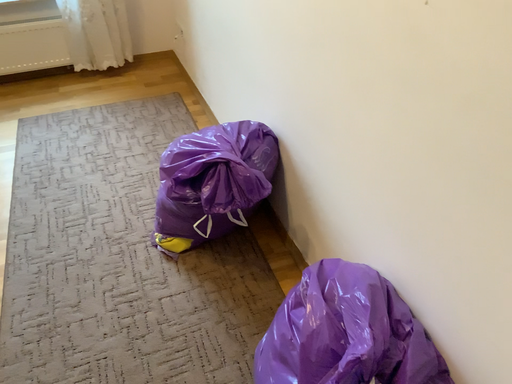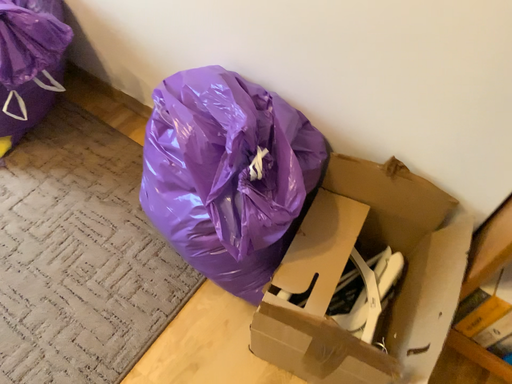
Question: Which way did the camera rotate in the video?

Choices:
 (A) rotated upward
 (B) rotated downward

Answer: (B)